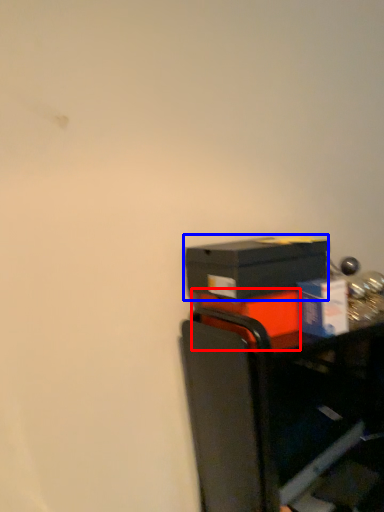
Question: Which point is closer to the camera, box (highlighted by a red box) or box (highlighted by a blue box)?

Choices:
 (A) box
 (B) box

Answer: (B)